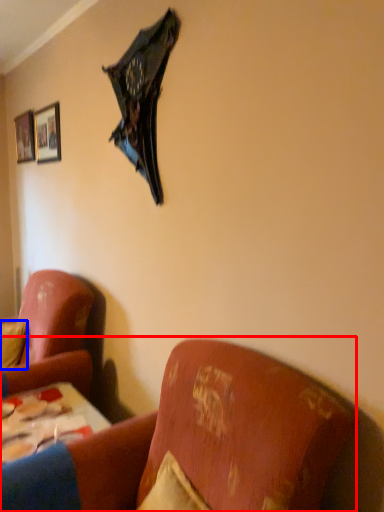
Question: Which object is further to the camera taking this photo, studio couch (highlighted by a red box) or pillow (highlighted by a blue box)?

Choices:
 (A) studio couch
 (B) pillow

Answer: (B)